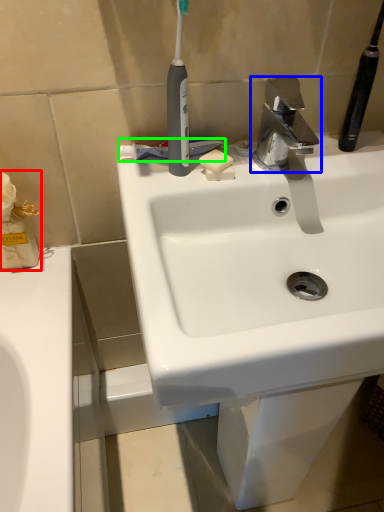
Question: Considering the real-world distances, which object is farthest from tissue (highlighted by a red box)? tap (highlighted by a blue box) or toothpaste (highlighted by a green box)?

Choices:
 (A) tap
 (B) toothpaste

Answer: (A)